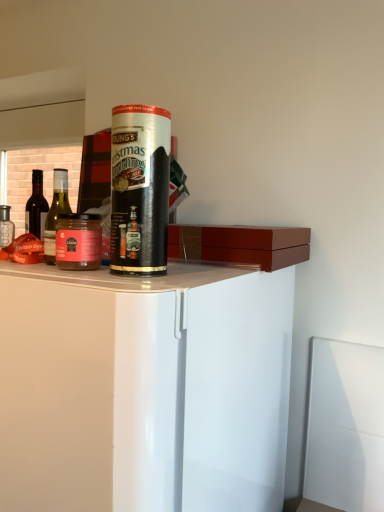
Locate an element on the screen. Image resolution: width=384 pixels, height=512 pixels. vacant region in front of green glass bottle at left, positioned as the 1th bottle in right-to-left order is located at coordinates (66, 272).